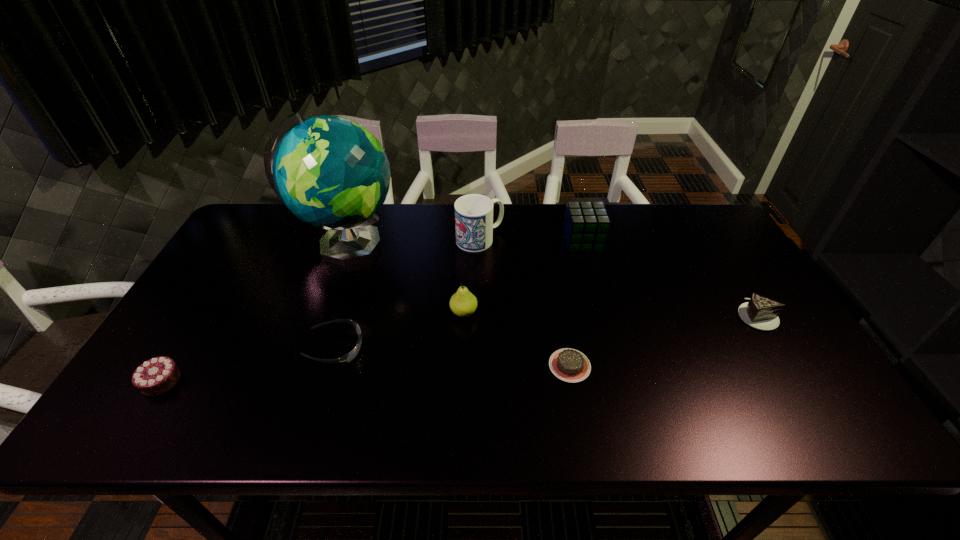
At what (x,y) coordinates should I click in order to perform the action: click on vacant space that satisfies the following two spatial constraints: 1. on the front side of the pear; 2. on the lenses of the sunglasses. Please return your answer as a coordinate pair (x, y). The width and height of the screenshot is (960, 540). Looking at the image, I should click on (463, 348).

Image resolution: width=960 pixels, height=540 pixels. Identify the location of vacant area that satisfies the following two spatial constraints: 1. on the back side of the mug; 2. on the left side of the leftmost chocolate cake. (249, 239).

Image resolution: width=960 pixels, height=540 pixels. Find the location of `free spot that satisfies the following two spatial constraints: 1. on the front side of the mug; 2. on the left side of the seventh object from left to right`. free spot that satisfies the following two spatial constraints: 1. on the front side of the mug; 2. on the left side of the seventh object from left to right is located at coordinates (480, 241).